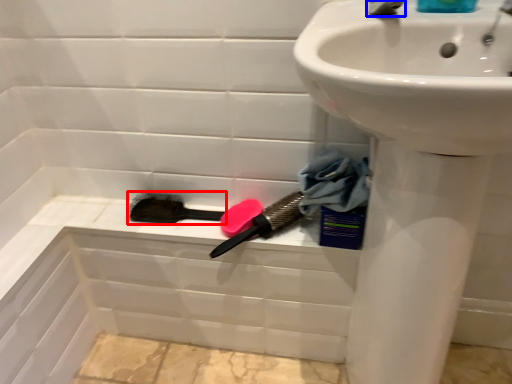
Question: Which of the following is the closest to the observer, brush (highlighted by a red box) or tap (highlighted by a blue box)?

Choices:
 (A) brush
 (B) tap

Answer: (B)